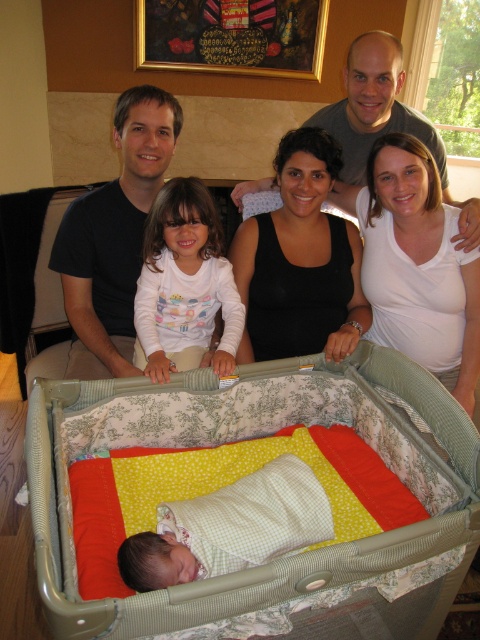
Who is more distant from viewer, (259, 227) or (428, 216)?

Positioned behind is point (259, 227).

Between point (324, 134) and point (389, 323), which one is positioned behind?

The point (389, 323) is more distant.

Find the location of a particular element. The height and width of the screenshot is (640, 480). black sleeveless top at center is located at coordinates (300, 260).

Can you confirm if white soft shirt at center is shorter than matte white baby at lower center?

Yes, white soft shirt at center is shorter than matte white baby at lower center.

Is point (202, 296) farther from viewer compared to point (264, 180)?

No, it is in front of (264, 180).

Locate an element on the screen. The width and height of the screenshot is (480, 640). white soft shirt at center is located at coordinates (183, 284).

Between yellow dotted fabric at center and black matte dress at center, which one has more height?

With more height is black matte dress at center.

Which is more to the right, yellow dotted fabric at center or black matte dress at center?

black matte dress at center

Is point (317, 417) positioned in front of point (471, 326)?

Yes.

Where is `yellow dotted fabric at center`? yellow dotted fabric at center is located at coordinates (249, 436).